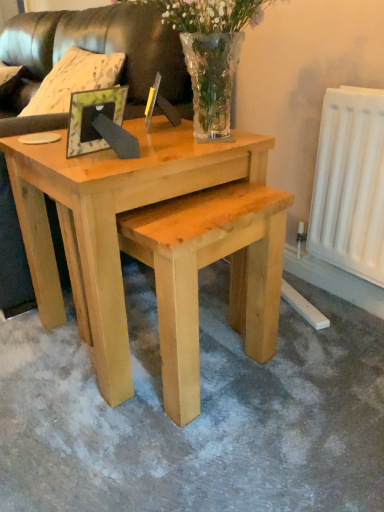
Question: Based on their sizes in the image, would you say leather couch at upper left, which is the 2th couch in front-to-back order, is bigger or smaller than clear glass vase at upper center?

Choices:
 (A) small
 (B) big

Answer: (B)

Question: Is point (140, 93) positioned closer to the camera than point (210, 39)?

Choices:
 (A) closer
 (B) farther

Answer: (B)

Question: Which is farther from the natural wood coffee table at center?

Choices:
 (A) clear glass vase at upper center
 (B) green leafy frame at center
 (C) leather couch at upper left, the first couch viewed from the back
 (D) leather couch at upper left, placed as the 2th couch when sorted from back to front

Answer: (C)

Question: Estimate the real-world distances between objects in this image. Which object is farther from the leather couch at upper left, the first couch viewed from the back?

Choices:
 (A) green leafy frame at center
 (B) natural wood coffee table at center
 (C) leather couch at upper left, the 1th couch from the front
 (D) clear glass vase at upper center

Answer: (A)